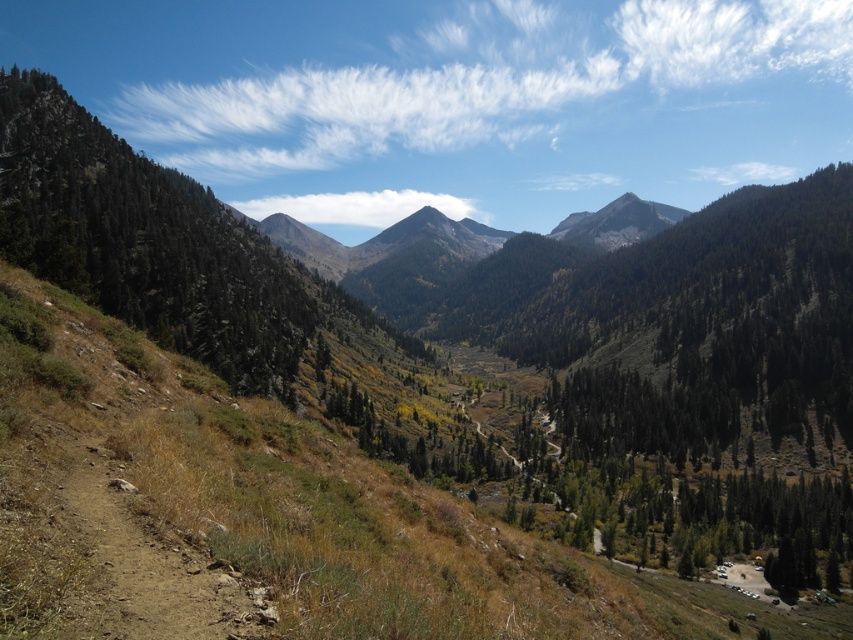
Question: Can you confirm if green leafy trees at left is positioned to the right of smooth brown mountain at center?

Choices:
 (A) yes
 (B) no

Answer: (B)

Question: Which object is farther from the camera taking this photo?

Choices:
 (A) smooth brown mountain at center
 (B) green leafy trees at left

Answer: (A)

Question: Can you confirm if green leafy trees at left is positioned to the left of smooth brown mountain at center?

Choices:
 (A) no
 (B) yes

Answer: (B)

Question: Observing the image, what is the correct spatial positioning of green leafy trees at left in reference to smooth brown mountain at center?

Choices:
 (A) above
 (B) below

Answer: (B)